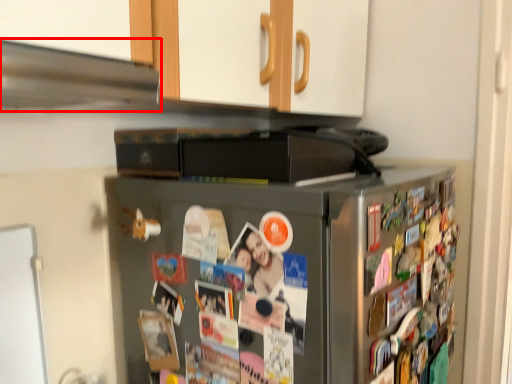
Question: Considering the relative positions of exhaust hood (annotated by the red box) and refrigerator in the image provided, where is exhaust hood (annotated by the red box) located with respect to the staircase?

Choices:
 (A) right
 (B) left

Answer: (B)